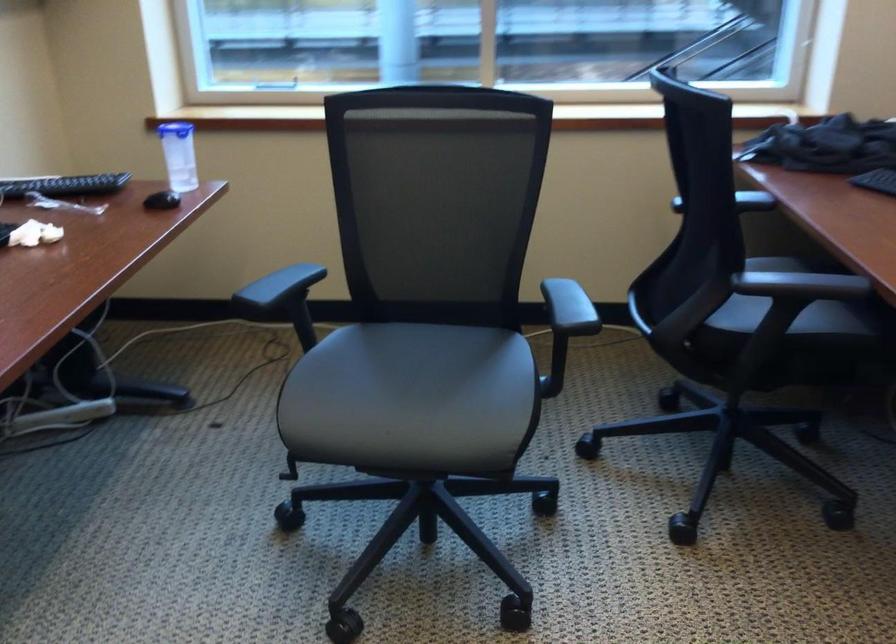
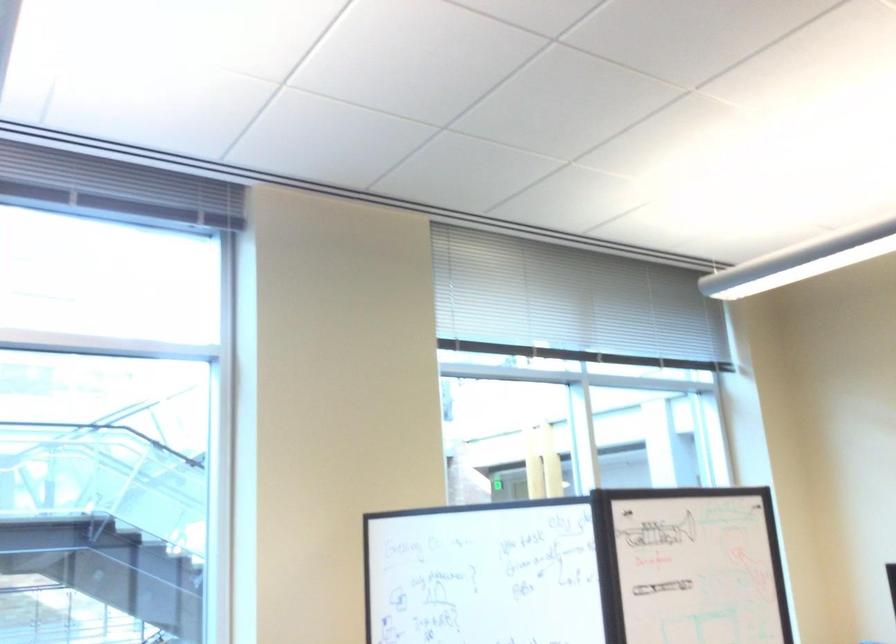
How did the camera likely rotate?

The camera's rotation is toward right-up.